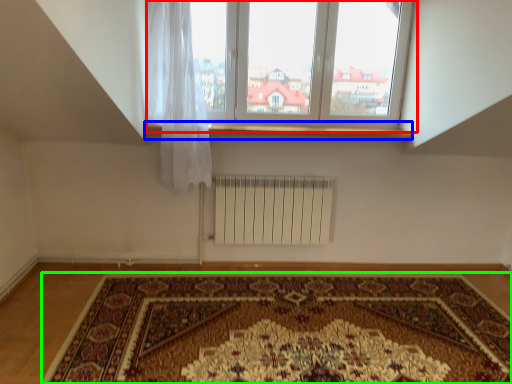
Question: Based on their relative distances, which object is nearer to window (highlighted by a red box)? Choose from window sill (highlighted by a blue box) and mat (highlighted by a green box).

Choices:
 (A) window sill
 (B) mat

Answer: (A)